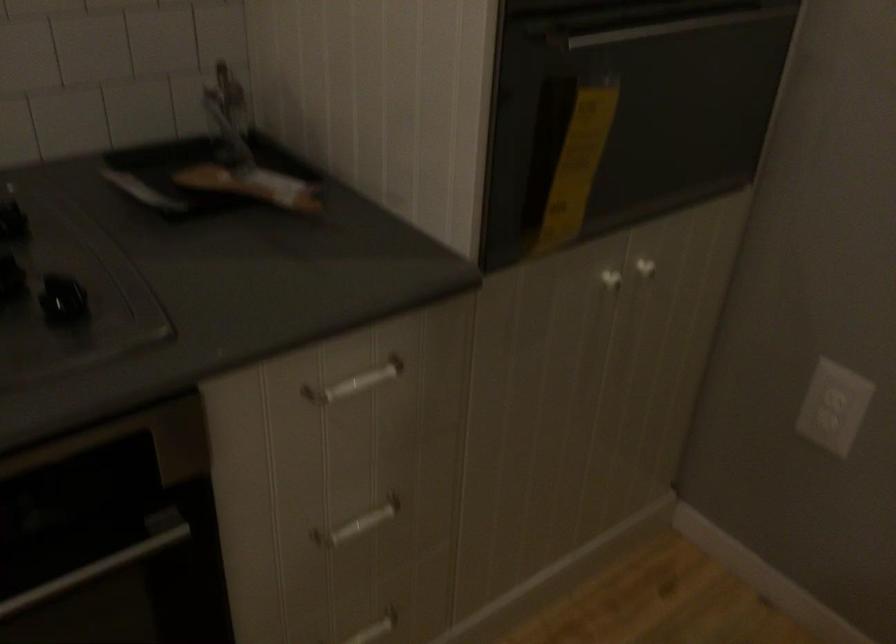
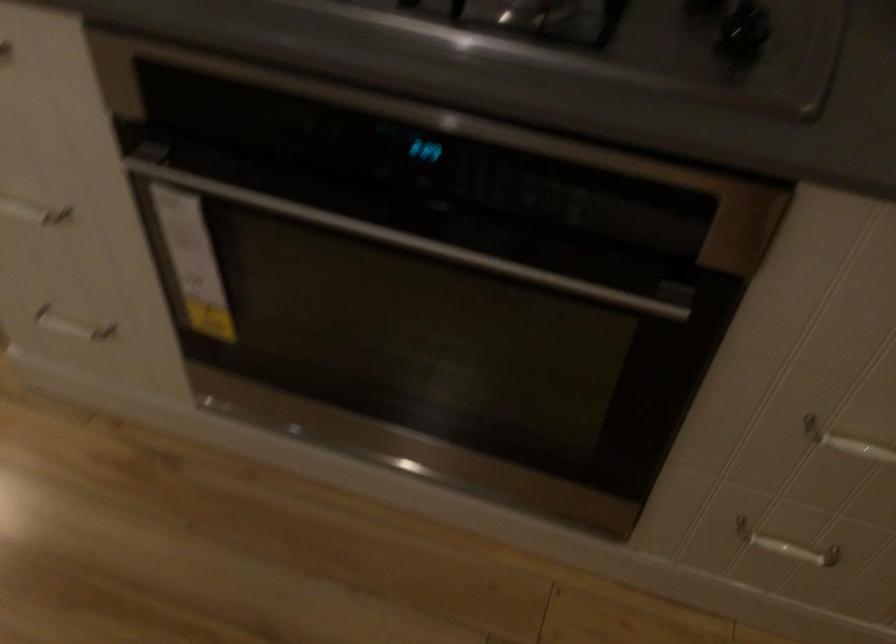
The images are taken continuously from a first-person perspective. In which direction is your viewpoint rotating?

The rotation direction of the camera is left-down.